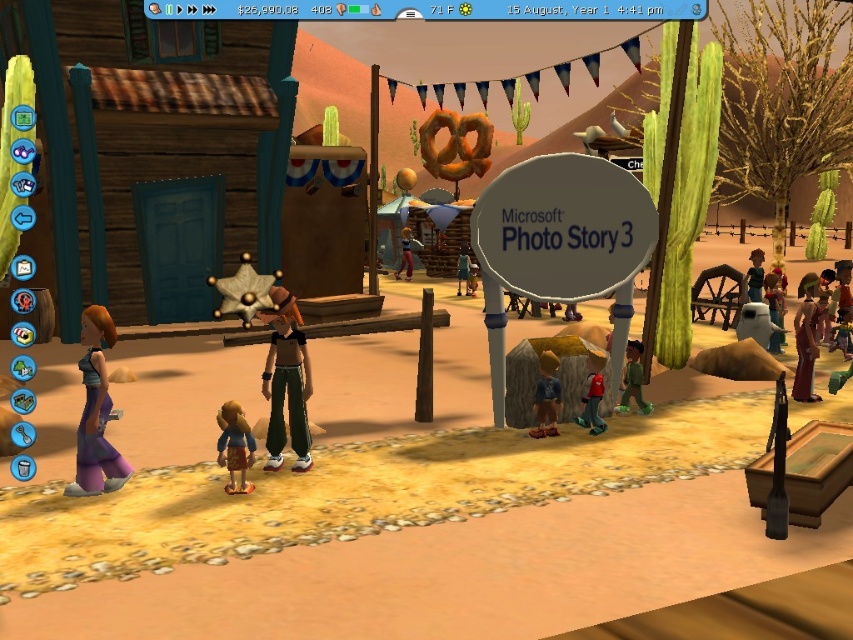
Question: Considering the real-world distances, which object is farthest from the blue denim shorts at center?

Choices:
 (A) brown leather jacket at center
 (B) brown leather jacket at right

Answer: (A)

Question: Considering the real-world distances, which object is closest to the brown velvet dress at right?

Choices:
 (A) brown fabric teddy bear at center
 (B) smooth brown leather jacket at right
 (C) green matte shirt at lower right
 (D) blue denim shorts at center

Answer: (C)

Question: In this image, where is purple fabric dress at lower left located relative to red matte toy at lower right?

Choices:
 (A) above
 (B) below

Answer: (A)

Question: Is purple fabric dress at lower left positioned in front of red matte toy at lower right?

Choices:
 (A) yes
 (B) no

Answer: (A)

Question: Can you confirm if matte brown cowboy hat at center is positioned above brown leather jacket at right?

Choices:
 (A) yes
 (B) no

Answer: (A)

Question: Based on their relative distances, which object is farther from the green matte shirt at lower right?

Choices:
 (A) brown leather jacket at center
 (B) matte brown cowboy hat at center
 (C) red matte toy at lower right

Answer: (A)